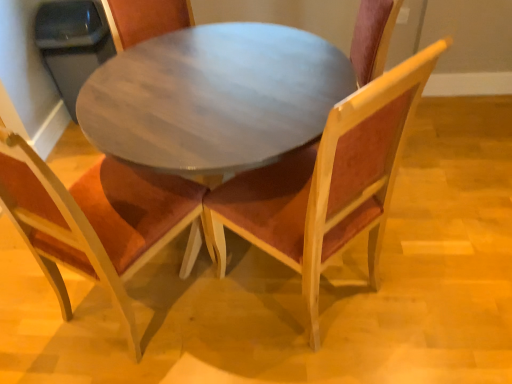
Question: From the image's perspective, is wooden round table at center on velvet burgundy chair at center, arranged as the first chair when viewed from the right?

Choices:
 (A) no
 (B) yes

Answer: (B)

Question: From a real-world perspective, is wooden round table at center positioned under velvet burgundy chair at center, placed as the second chair when sorted from left to right, based on gravity?

Choices:
 (A) yes
 (B) no

Answer: (A)

Question: Considering the relative sizes of wooden round table at center and velvet burgundy chair at center, arranged as the first chair when viewed from the right, in the image provided, is wooden round table at center wider than velvet burgundy chair at center, arranged as the first chair when viewed from the right,?

Choices:
 (A) no
 (B) yes

Answer: (B)

Question: Is wooden round table at center further to camera compared to velvet burgundy chair at center, placed as the second chair when sorted from left to right?

Choices:
 (A) yes
 (B) no

Answer: (A)

Question: Is wooden round table at center positioned with its back to velvet burgundy chair at center, arranged as the first chair when viewed from the right?

Choices:
 (A) no
 (B) yes

Answer: (A)

Question: From a real-world perspective, is wooden round table at center positioned above or below velvet burgundy chair at center, arranged as the first chair when viewed from the right?

Choices:
 (A) above
 (B) below

Answer: (B)

Question: From the image's perspective, relative to velvet burgundy chair at center, placed as the second chair when sorted from left to right, is wooden round table at center above or below?

Choices:
 (A) below
 (B) above

Answer: (B)

Question: Is point 128,72 positioned closer to the camera than point 430,54?

Choices:
 (A) closer
 (B) farther

Answer: (B)

Question: Looking at the image, does wooden round table at center seem bigger or smaller compared to velvet burgundy chair at center, placed as the second chair when sorted from left to right?

Choices:
 (A) big
 (B) small

Answer: (A)

Question: From the image's perspective, is wooden chair with orange cushion at center, which is the first chair from left to right, located above or below velvet burgundy chair at center, arranged as the first chair when viewed from the right?

Choices:
 (A) above
 (B) below

Answer: (B)

Question: Is wooden chair with orange cushion at center, which ranks as the second chair in right-to-left order, to the left or to the right of velvet burgundy chair at center, arranged as the first chair when viewed from the right, in the image?

Choices:
 (A) right
 (B) left

Answer: (B)

Question: Is point (123, 243) positioned closer to the camera than point (377, 254)?

Choices:
 (A) farther
 (B) closer

Answer: (B)

Question: Is wooden chair with orange cushion at center, which ranks as the second chair in right-to-left order, wider or thinner than velvet burgundy chair at center, arranged as the first chair when viewed from the right?

Choices:
 (A) wide
 (B) thin

Answer: (A)

Question: Relative to wooden round table at center, is velvet burgundy chair at center, placed as the second chair when sorted from left to right, in front or behind?

Choices:
 (A) behind
 (B) front

Answer: (B)

Question: Is velvet burgundy chair at center, arranged as the first chair when viewed from the right, inside or outside of wooden round table at center?

Choices:
 (A) outside
 (B) inside

Answer: (B)